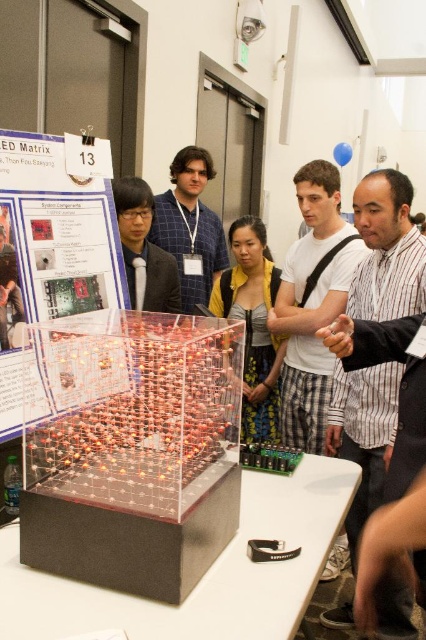
Who is positioned more to the right, transparent acrylic cube at center or yellow fabric dress at center?

yellow fabric dress at center is more to the right.

Who is higher up, transparent acrylic cube at center or yellow fabric dress at center?

yellow fabric dress at center is above.

This screenshot has height=640, width=426. What do you see at coordinates (132, 451) in the screenshot?
I see `transparent acrylic cube at center` at bounding box center [132, 451].

At what (x,y) coordinates should I click in order to perform the action: click on transparent acrylic cube at center. Please return your answer as a coordinate pair (x, y). Looking at the image, I should click on click(x=132, y=451).

Who is more forward, (95,621) or (187,216)?

Positioned in front is point (95,621).

Who is higher up, white matte table at center or blue plaid shirt at center?

blue plaid shirt at center

Find the location of a particular element. white matte table at center is located at coordinates (204, 576).

Can you confirm if white matte table at center is taller than clear plastic poster at center?

No.

Looking at this image, is white matte table at center behind clear plastic poster at center?

No, white matte table at center is in front of clear plastic poster at center.

Is point (103, 625) positioned after point (48, 304)?

No, (103, 625) is in front of (48, 304).

What are the coordinates of `white matte table at center` in the screenshot? It's located at (204, 576).